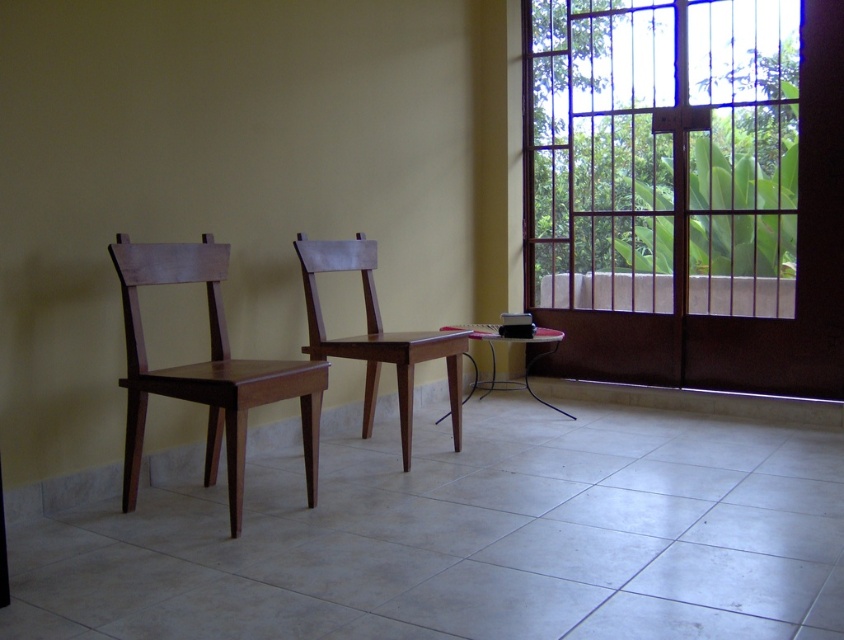
You are standing in the room and want to move from the matte wood chair at left to the matte wood chair at center. Which direction should you move relative to the chairs?

The matte wood chair at left is located below the matte wood chair at center, so you should move upward to reach it.

You are standing in the room and want to determine the relative positions of two points. Which point is closer to you, point [126,508] or point [344,257]?

Point [126,508] is closer to the viewer than point [344,257].

You are trying to place a rectangular box that is 1.2 meters wide between the matte wood chair at center and the metallic silver table at center. Can the box fit in the space between them?

The matte wood chair at center might be wider than metallic silver table at center, so the space between them may not be wide enough to accommodate the 1.2 meter wide box. You should measure the actual width before placing the box.